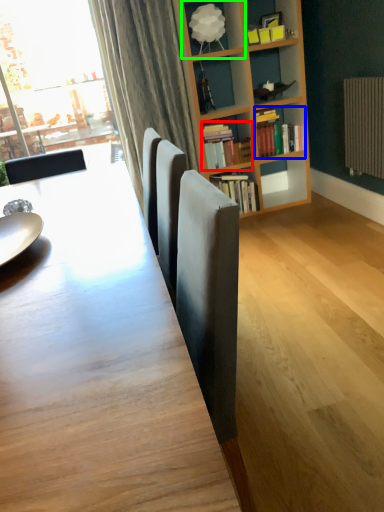
Question: Estimate the real-world distances between objects in this image. Which object is closer to book (highlighted by a red box), book (highlighted by a blue box) or shelf (highlighted by a green box)?

Choices:
 (A) book
 (B) shelf

Answer: (A)